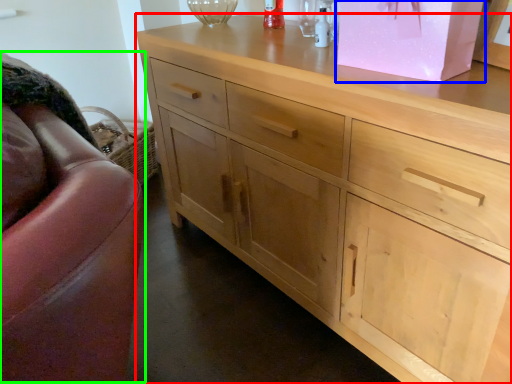
Question: Estimate the real-world distances between objects in this image. Which object is farther from chest of drawers (highlighted by a red box), cabinetry (highlighted by a blue box) or swivel chair (highlighted by a green box)?

Choices:
 (A) cabinetry
 (B) swivel chair

Answer: (B)